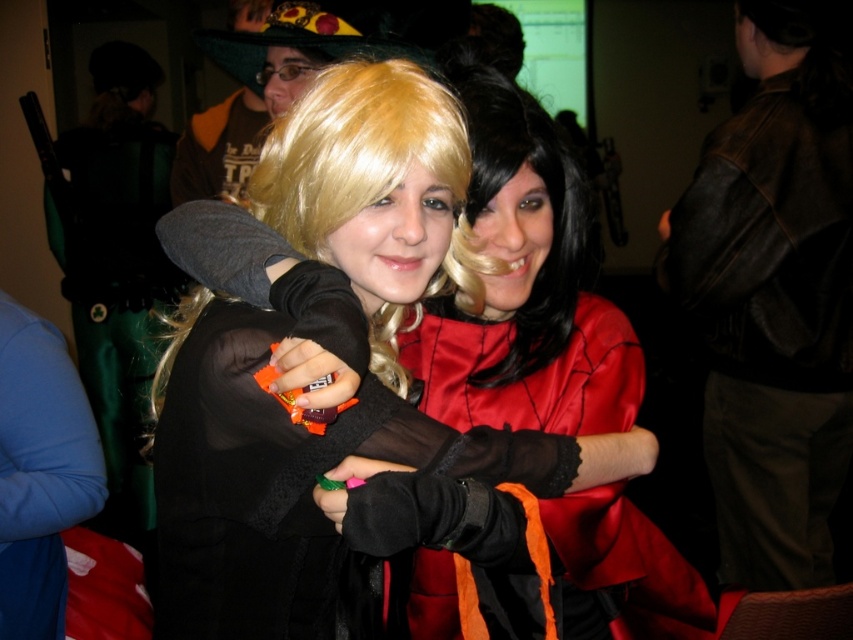
Question: Estimate the real-world distances between objects in this image. Which object is farther from the satin red dress at center?

Choices:
 (A) shiny satin dress at center
 (B) velvet black gloves at center

Answer: (B)

Question: Does velvet black gloves at center appear on the right side of satin red dress at center?

Choices:
 (A) no
 (B) yes

Answer: (A)

Question: Which of these objects is positioned closest to the shiny satin dress at center?

Choices:
 (A) velvet black gloves at center
 (B) satin red dress at center

Answer: (B)

Question: Is shiny satin dress at center to the left of satin red dress at center from the viewer's perspective?

Choices:
 (A) no
 (B) yes

Answer: (B)

Question: Is shiny satin dress at center bigger than satin red dress at center?

Choices:
 (A) no
 (B) yes

Answer: (B)

Question: Among these points, which one is nearest to the camera?

Choices:
 (A) pyautogui.click(x=612, y=358)
 (B) pyautogui.click(x=171, y=476)

Answer: (B)